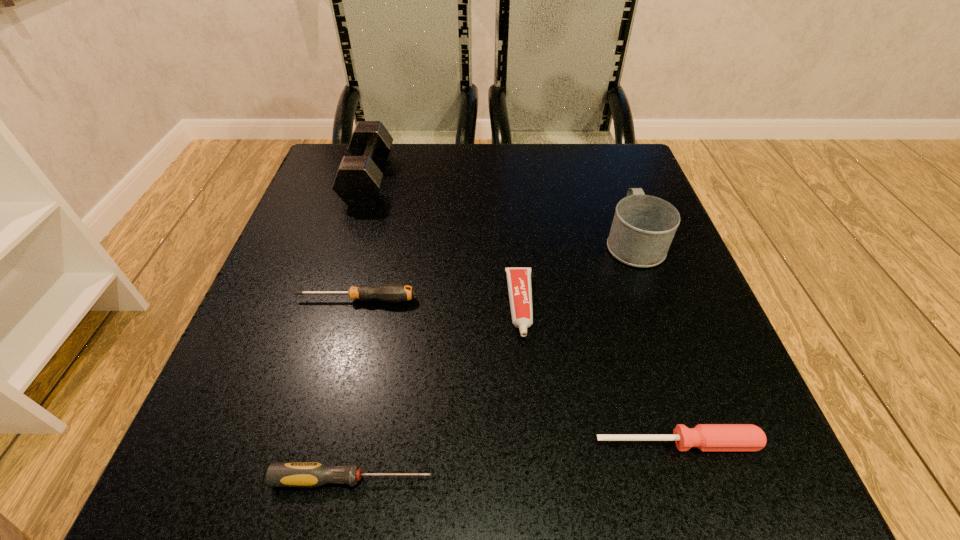
Find the location of a particular element. This screenshot has height=540, width=960. the farthest object is located at coordinates (358, 180).

You are a GUI agent. You are given a task and a screenshot of the screen. Output one action in this format:
    pyautogui.click(x=<x>, y=<y>)
    Task: Click on the mug
    The height and width of the screenshot is (540, 960).
    Given the screenshot: What is the action you would take?
    pyautogui.click(x=643, y=227)

Identify the location of the farthest screwdriver. (393, 292).

This screenshot has width=960, height=540. Identify the location of the fifth farthest object. (707, 437).

Locate an element on the screen. the second farthest screwdriver is located at coordinates (707, 437).

Find the location of a particular element. Image resolution: width=960 pixels, height=540 pixels. the third object from right to left is located at coordinates pos(518,279).

This screenshot has height=540, width=960. I want to click on the nearest screwdriver, so point(279,474).

Image resolution: width=960 pixels, height=540 pixels. I want to click on vacant area located 0.070m on the front of the dumbbell, so click(x=354, y=227).

Locate an element on the screen. Image resolution: width=960 pixels, height=540 pixels. free space located 0.070m on the side of the second farthest object with the handle is located at coordinates (617, 198).

Where is `free spot located 0.280m on the side of the second farthest object with the handle`? The height and width of the screenshot is (540, 960). free spot located 0.280m on the side of the second farthest object with the handle is located at coordinates (600, 148).